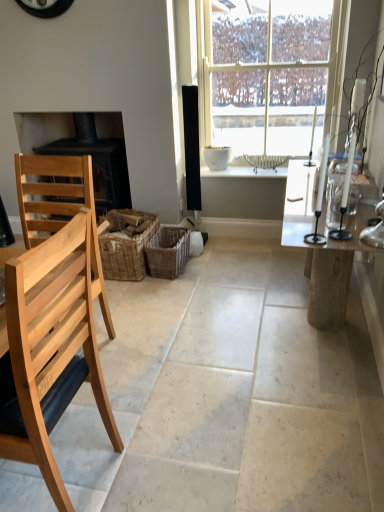
I want to click on vacant area to the right of natural wood chair at left, acting as the second chair starting from the back, so click(158, 454).